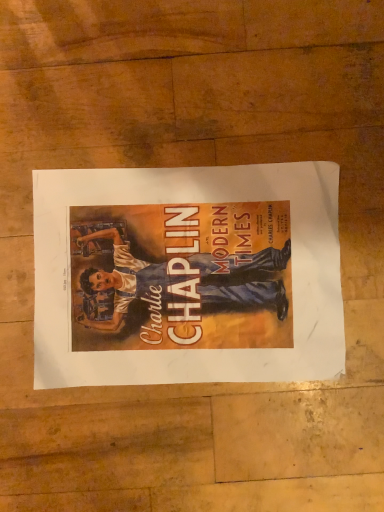
Describe the element at coordinates (187, 275) in the screenshot. The height and width of the screenshot is (512, 384). I see `denim poster at center` at that location.

You are a GUI agent. You are given a task and a screenshot of the screen. Output one action in this format:
    pyautogui.click(x=<x>, y=<y>)
    Task: Click on the denim poster at center
    The height and width of the screenshot is (512, 384).
    Given the screenshot: What is the action you would take?
    pyautogui.click(x=187, y=275)

Where is `denim poster at center`? Image resolution: width=384 pixels, height=512 pixels. denim poster at center is located at coordinates (187, 275).